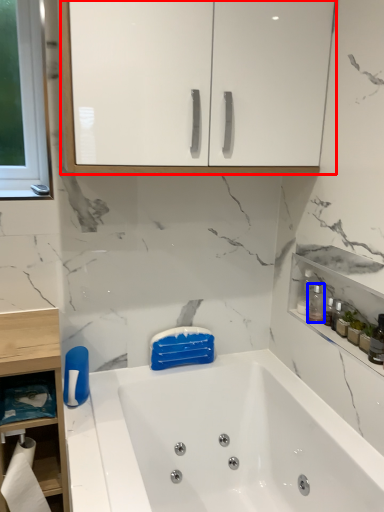
Question: Which point is further to the camera, cabinetry (highlighted by a red box) or cleaning product (highlighted by a blue box)?

Choices:
 (A) cabinetry
 (B) cleaning product

Answer: (B)